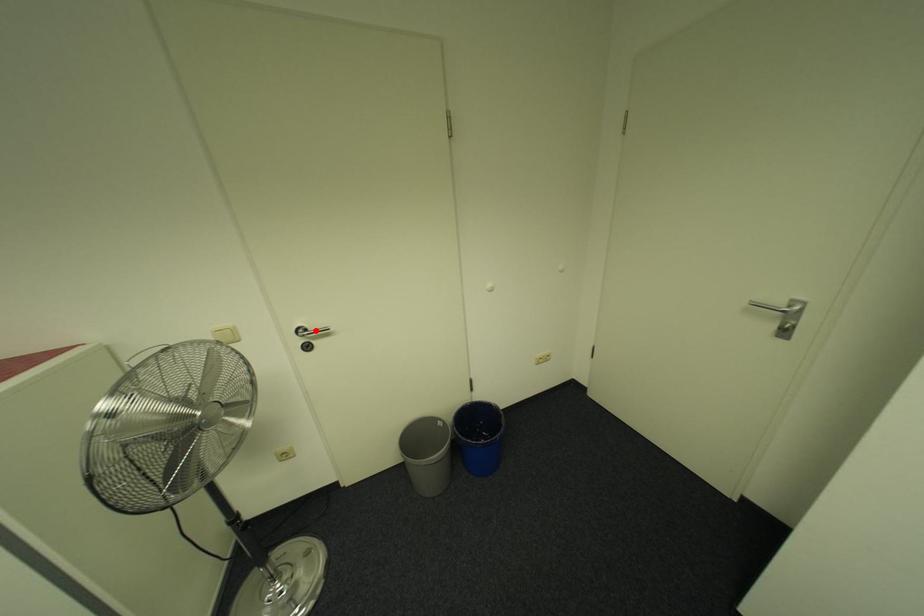
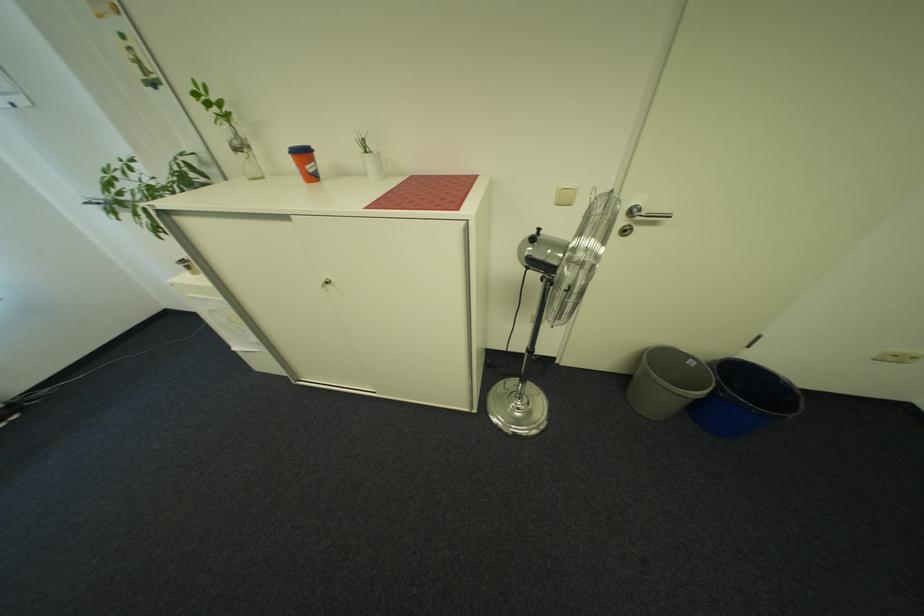
Find the pixel in the second image that matches the highlighted location in the first image.

(650, 211)